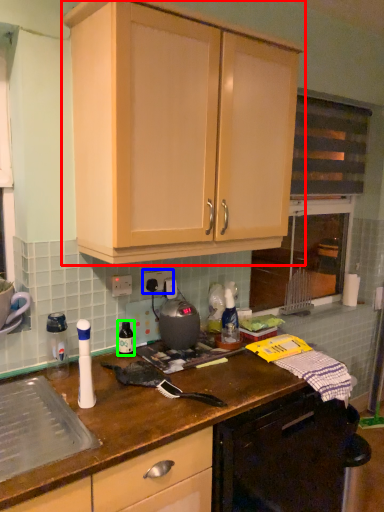
Question: Which object is the farthest from cabinetry (highlighted by a red box)? Choose among these: electric outlet (highlighted by a blue box) or bottle (highlighted by a green box).

Choices:
 (A) electric outlet
 (B) bottle

Answer: (B)